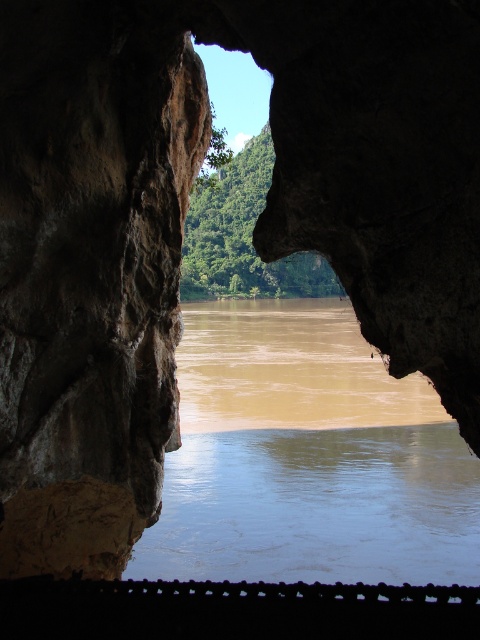
Is point (68, 380) closer to viewer compared to point (467, 518)?

Yes, it is in front of point (467, 518).

Which is in front, point (155, 276) or point (475, 458)?

Point (155, 276)

Is point (28, 536) positioned behind point (336, 428)?

No, it is not.

The height and width of the screenshot is (640, 480). In order to click on rough stone wall at left in this screenshot , I will do `click(91, 269)`.